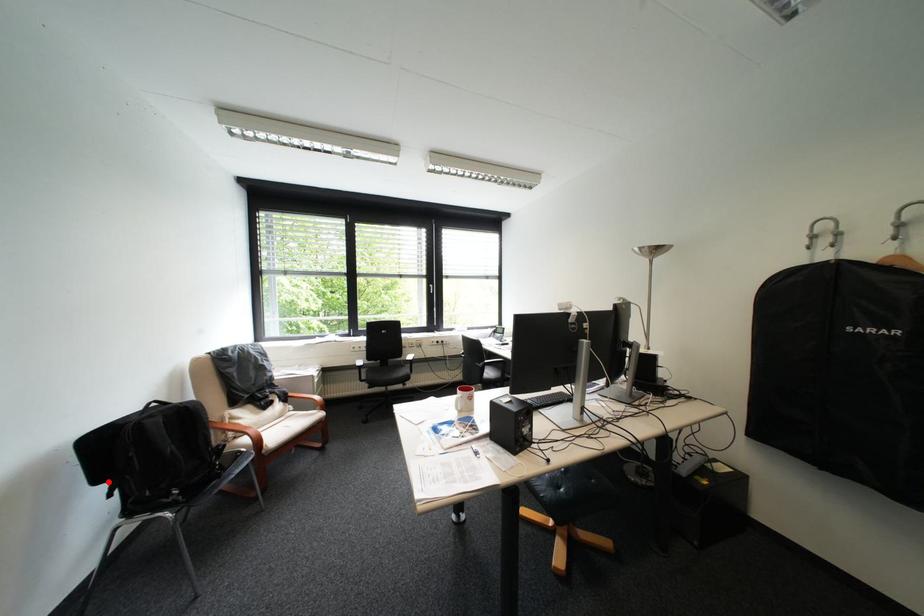
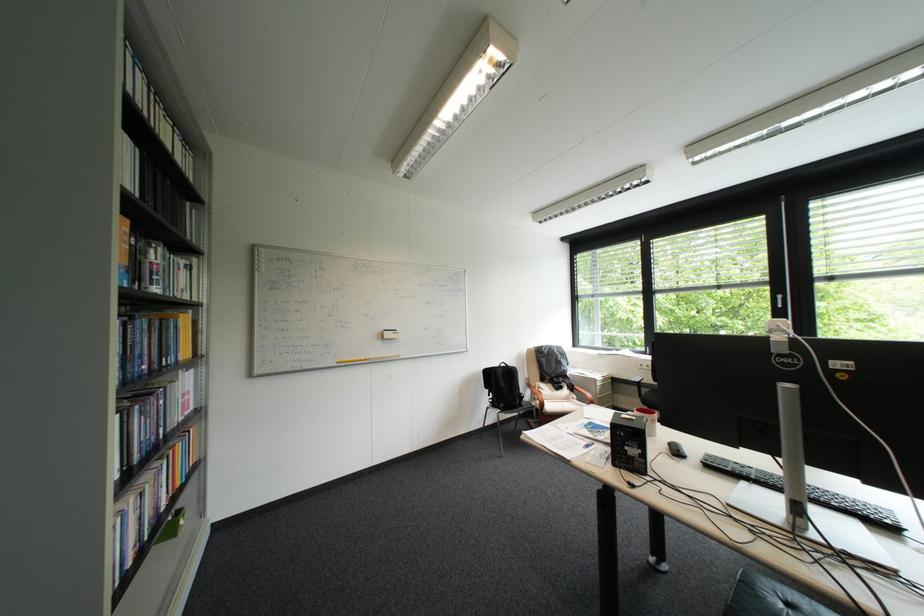
Question: I am providing you with two images of the same scene from different viewpoints. A red point is shown in image1. For the corresponding object point in image2, is it positioned nearer or farther from the camera?

Choices:
 (A) Nearer
 (B) Farther

Answer: (B)